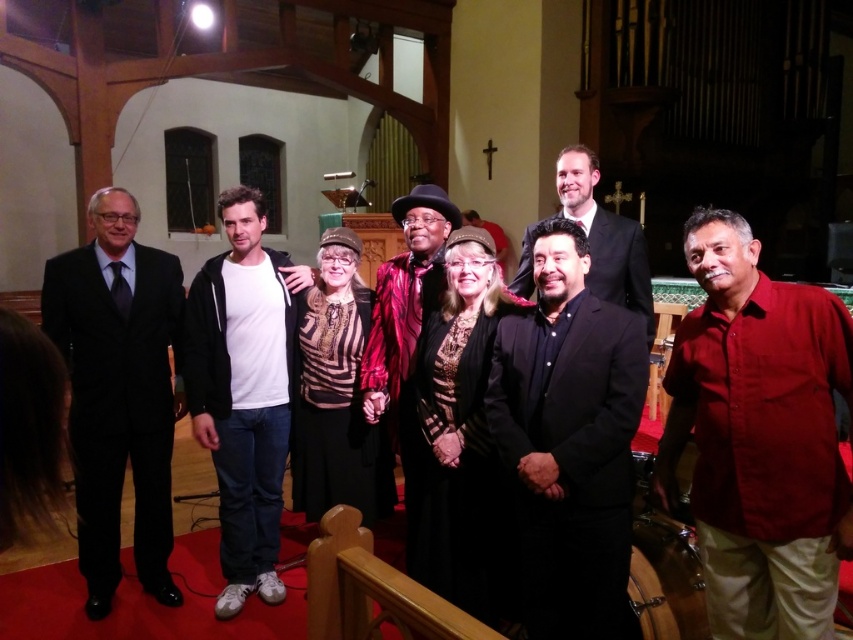
Question: Is matte red shirt at right above black satin suit at center?

Choices:
 (A) no
 (B) yes

Answer: (B)

Question: Which object is farther from the camera taking this photo?

Choices:
 (A) black satin suit at center
 (B) matte black suit at left

Answer: (B)

Question: Can you confirm if black satin suit at center is positioned to the right of shiny red jacket at center?

Choices:
 (A) no
 (B) yes

Answer: (B)

Question: Which object appears farthest from the camera in this image?

Choices:
 (A) matte black suit at left
 (B) black satin suit at center

Answer: (A)

Question: In this image, where is matte red shirt at right located relative to matte black suit at left?

Choices:
 (A) left
 (B) right

Answer: (B)

Question: Estimate the real-world distances between objects in this image. Which object is farther from the black satin suit at center?

Choices:
 (A) white cotton hoodie at center
 (B) matte black suit at center
 (C) matte black suit at left

Answer: (C)